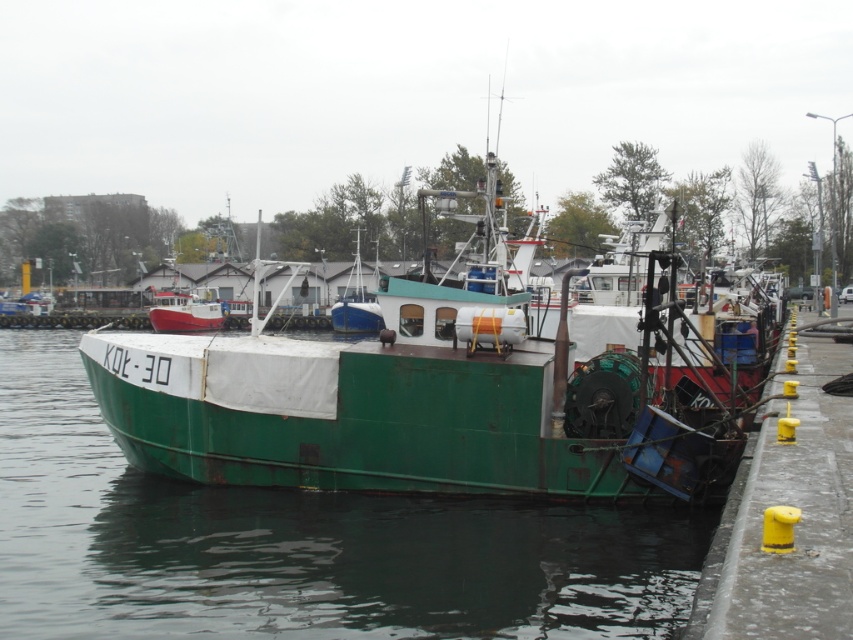
Question: Does green matte boat at center have a smaller size compared to yellow rubber bollard at lower right?

Choices:
 (A) yes
 (B) no

Answer: (B)

Question: Is green matte boat at center thinner than yellow rubber bollard at lower right?

Choices:
 (A) yes
 (B) no

Answer: (B)

Question: Which object appears closest to the camera in this image?

Choices:
 (A) green matte water at center
 (B) yellow rubber bollard at lower right
 (C) green matte boat at center

Answer: (B)

Question: Which object appears farthest from the camera in this image?

Choices:
 (A) green matte boat at center
 (B) green matte water at center
 (C) yellow rubber bollard at lower right

Answer: (A)

Question: Is green matte water at center in front of yellow rubber bollard at lower right?

Choices:
 (A) no
 (B) yes

Answer: (A)

Question: Which object is positioned farthest from the green matte water at center?

Choices:
 (A) yellow rubber bollard at lower right
 (B) green matte boat at center

Answer: (B)